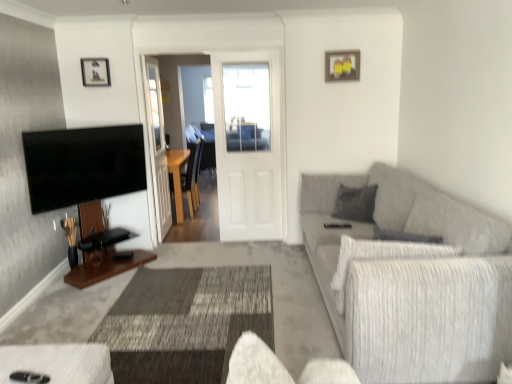
Question: Is white matte door at center closer to camera compared to wooden picture frame at upper center, the first picture frame positioned from the right?

Choices:
 (A) yes
 (B) no

Answer: (B)

Question: Would you say white matte door at center is outside wooden picture frame at upper center, the 2th picture frame viewed from the left?

Choices:
 (A) yes
 (B) no

Answer: (A)

Question: Is white matte door at center to the left of wooden picture frame at upper center, the 2th picture frame viewed from the left, from the viewer's perspective?

Choices:
 (A) no
 (B) yes

Answer: (B)

Question: Is white matte door at center far away from wooden picture frame at upper center, the first picture frame positioned from the right?

Choices:
 (A) no
 (B) yes

Answer: (B)

Question: Can you confirm if white matte door at center is shorter than wooden picture frame at upper center, the 2th picture frame viewed from the left?

Choices:
 (A) yes
 (B) no

Answer: (B)

Question: Considering the positions of black glossy flat-screen tv at left and transparent glass door at center in the image, is black glossy flat-screen tv at left bigger or smaller than transparent glass door at center?

Choices:
 (A) small
 (B) big

Answer: (A)

Question: Is black glossy flat-screen tv at left to the left or to the right of transparent glass door at center in the image?

Choices:
 (A) right
 (B) left

Answer: (B)

Question: Considering the positions of point (31, 170) and point (154, 150), is point (31, 170) closer or farther from the camera than point (154, 150)?

Choices:
 (A) farther
 (B) closer

Answer: (B)

Question: Considering the positions of black glossy flat-screen tv at left and transparent glass door at center in the image, is black glossy flat-screen tv at left wider or thinner than transparent glass door at center?

Choices:
 (A) wide
 (B) thin

Answer: (A)

Question: Considering the positions of textured gray couch at right and wooden picture frame at upper center, the first picture frame positioned from the right, in the image, is textured gray couch at right taller or shorter than wooden picture frame at upper center, the first picture frame positioned from the right,?

Choices:
 (A) short
 (B) tall

Answer: (B)

Question: In terms of width, does textured gray couch at right look wider or thinner when compared to wooden picture frame at upper center, the 2th picture frame viewed from the left?

Choices:
 (A) thin
 (B) wide

Answer: (B)

Question: Based on their sizes in the image, would you say textured gray couch at right is bigger or smaller than wooden picture frame at upper center, the 2th picture frame viewed from the left?

Choices:
 (A) small
 (B) big

Answer: (B)

Question: From the image's perspective, is textured gray couch at right located above or below wooden picture frame at upper center, the 2th picture frame viewed from the left?

Choices:
 (A) below
 (B) above

Answer: (A)

Question: Visually, is wooden picture frame at upper center, the 1th picture frame from the left, positioned to the left or to the right of textured gray couch at right?

Choices:
 (A) left
 (B) right

Answer: (A)

Question: From a real-world perspective, is wooden picture frame at upper center, the 2th picture frame when ordered from right to left, positioned above or below textured gray couch at right?

Choices:
 (A) below
 (B) above

Answer: (B)